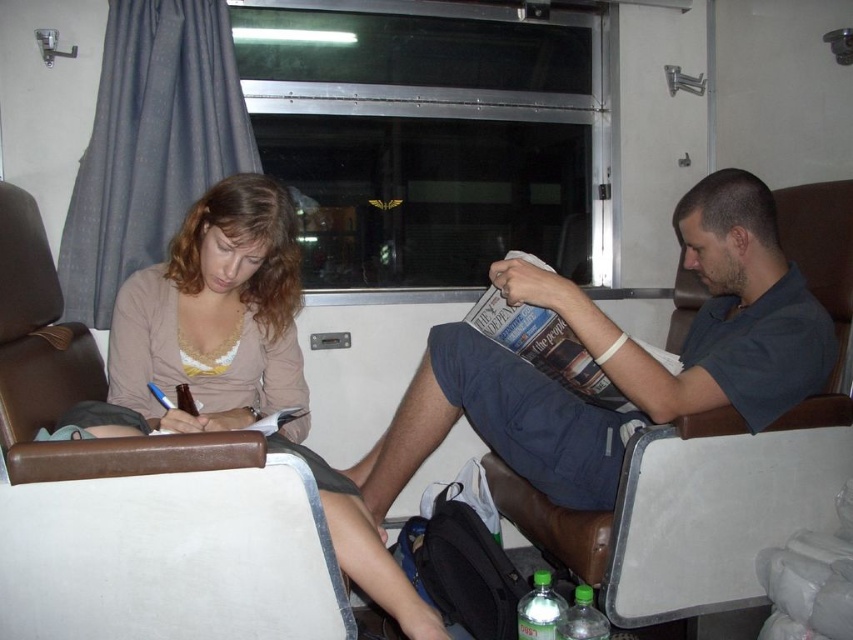
From the picture: You are a person who is 160 cm tall. You are sitting on the brown leather chair at center and want to reach the matte paper magazine at center. Can you easily pick it up without standing?

The brown leather chair at center is much taller as matte paper magazine at center, so the height difference may make it difficult for a 160 cm tall person to easily pick up the matte paper magazine at center without standing.

Based on the photo, you are sitting in the brown leather chair at center and want to hand a book to the person in the brown leather chair at left. Can you reach them without leaving your seat?

The brown leather chair at left is in front of the brown leather chair at center, so you can reach the person in the brown leather chair at left from your current position in the brown leather chair at center without needing to leave your seat.

You are a traveler who wants to place a new travel guidebook on the seat next to the brown leather chair at left without overlapping the matte paper magazine at center. Is there enough space?

The brown leather chair at left is larger in size than matte paper magazine at center, so there is sufficient space to place the travel guidebook next to the brown leather chair at left without overlapping the matte paper magazine at center.